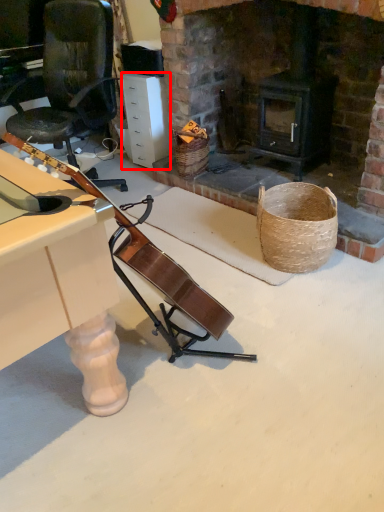
Question: From the image's perspective, where is drawer (annotated by the red box) located in relation to basket in the image?

Choices:
 (A) below
 (B) above

Answer: (B)